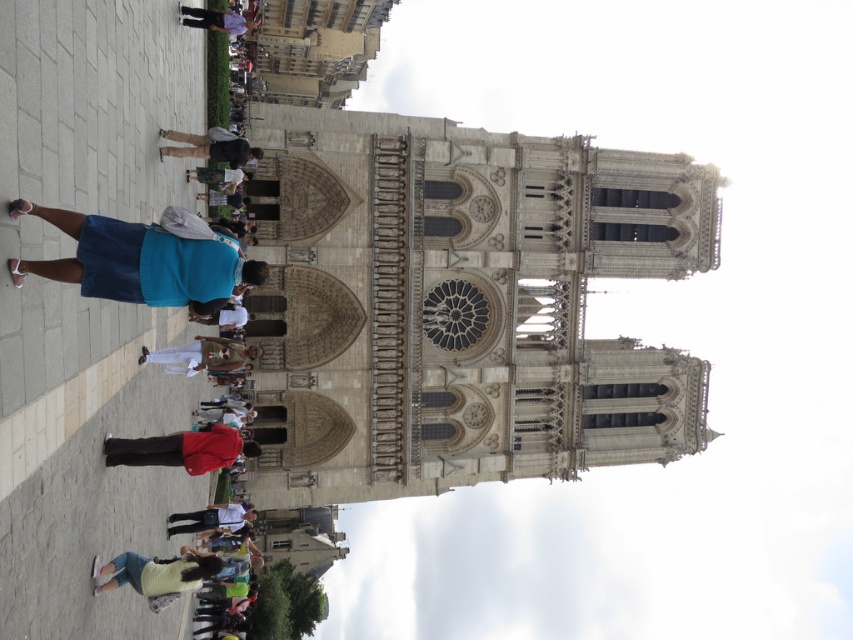
Question: Is blue sweater at center wider than purple cotton shirt at upper center?

Choices:
 (A) yes
 (B) no

Answer: (A)

Question: Which point is farther from the camera taking this photo?

Choices:
 (A) (225, 24)
 (B) (238, 172)
 (C) (166, 444)
 (D) (206, 352)

Answer: (A)

Question: Is dark brown leather jacket at center smaller than matte blue shirt at center?

Choices:
 (A) no
 (B) yes

Answer: (A)

Question: Can you confirm if red cotton shirt at center is positioned to the right of white cotton shirt at center?

Choices:
 (A) no
 (B) yes

Answer: (B)

Question: Which point is closer to the camera?

Choices:
 (A) (96, 593)
 (B) (181, 141)
 (C) (148, 461)
 (D) (200, 176)

Answer: (A)

Question: Which point is closer to the camera?

Choices:
 (A) light brown fabric pants at center
 (B) blue denim shorts at center
 (C) purple cotton shirt at upper center

Answer: (A)